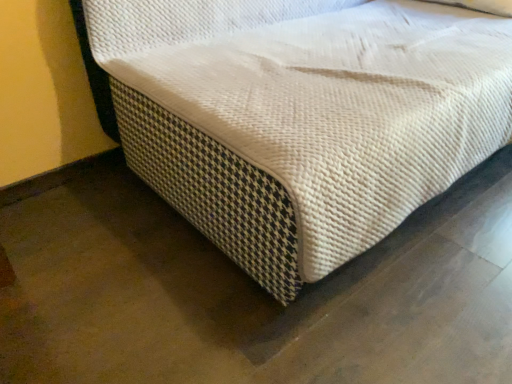
Locate an element on the screen. white woven mattress at center is located at coordinates (302, 117).

The image size is (512, 384). Describe the element at coordinates (302, 117) in the screenshot. I see `white woven mattress at center` at that location.

Where is `white woven mattress at center`? The image size is (512, 384). white woven mattress at center is located at coordinates (302, 117).